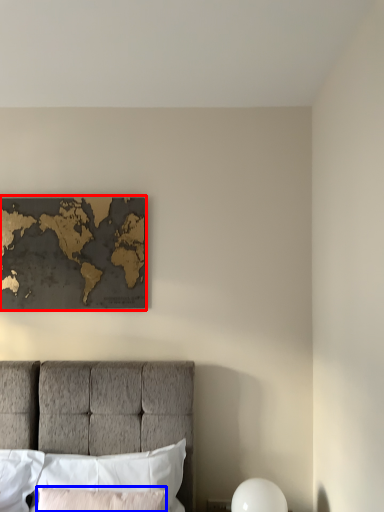
Question: Which object is closer to the camera taking this photo, picture frame (highlighted by a red box) or pillow (highlighted by a blue box)?

Choices:
 (A) picture frame
 (B) pillow

Answer: (B)